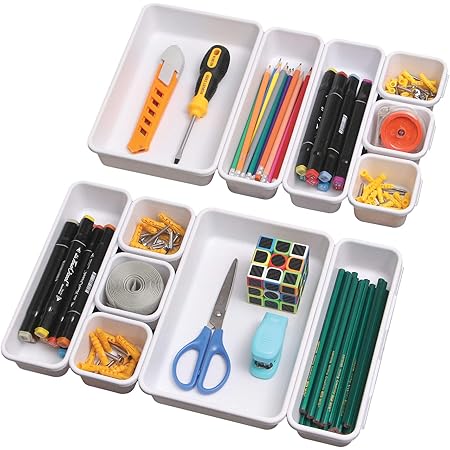
Locate an element on the screen. marker is located at coordinates (313, 130), (318, 145), (328, 150), (346, 161), (317, 186), (310, 182), (297, 178).